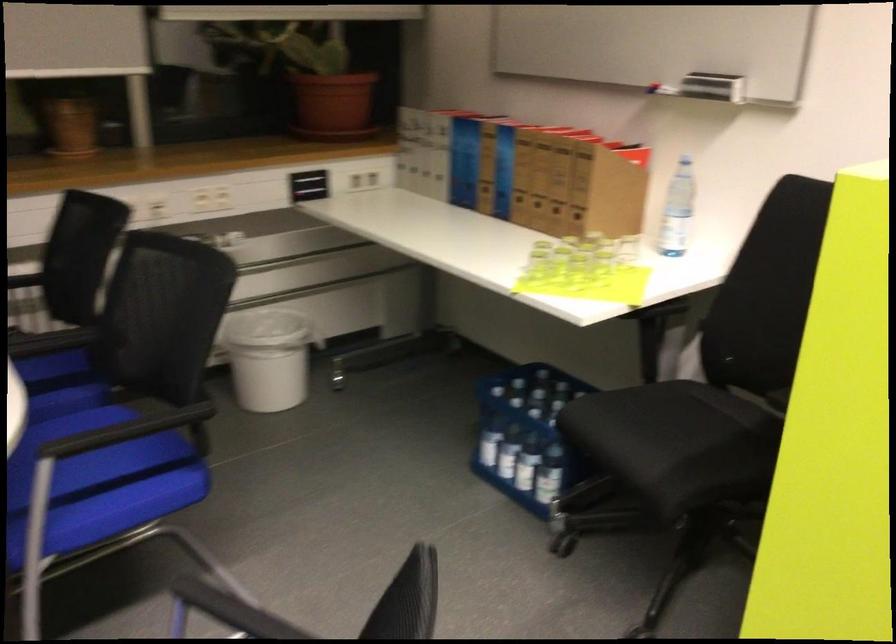
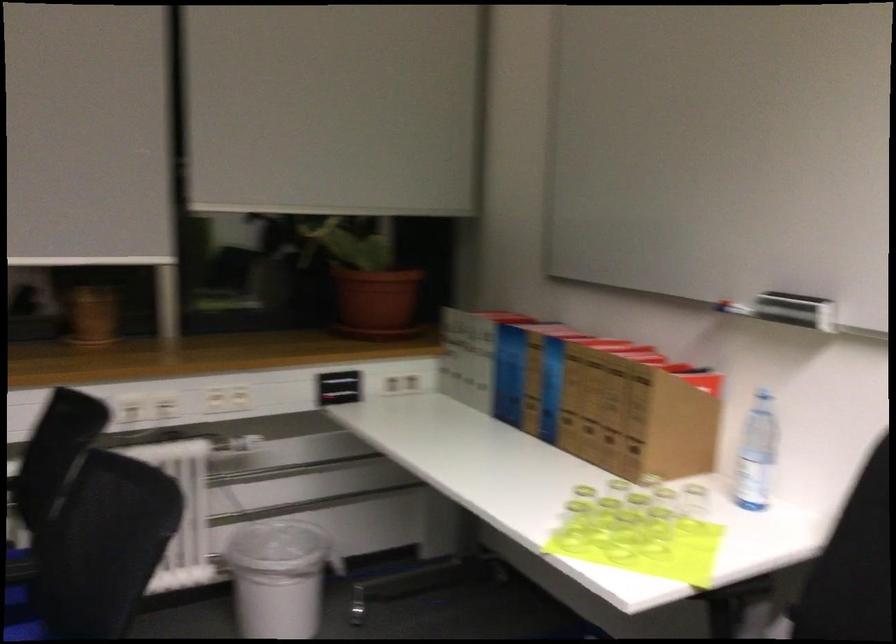
In the second image, find the point that corresponds to [711,86] in the first image.

(795, 310)